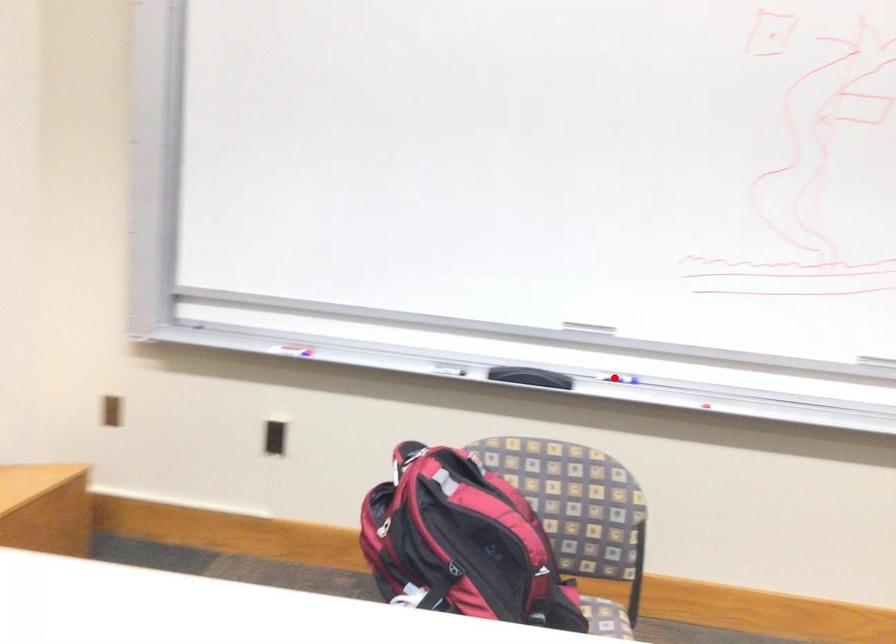
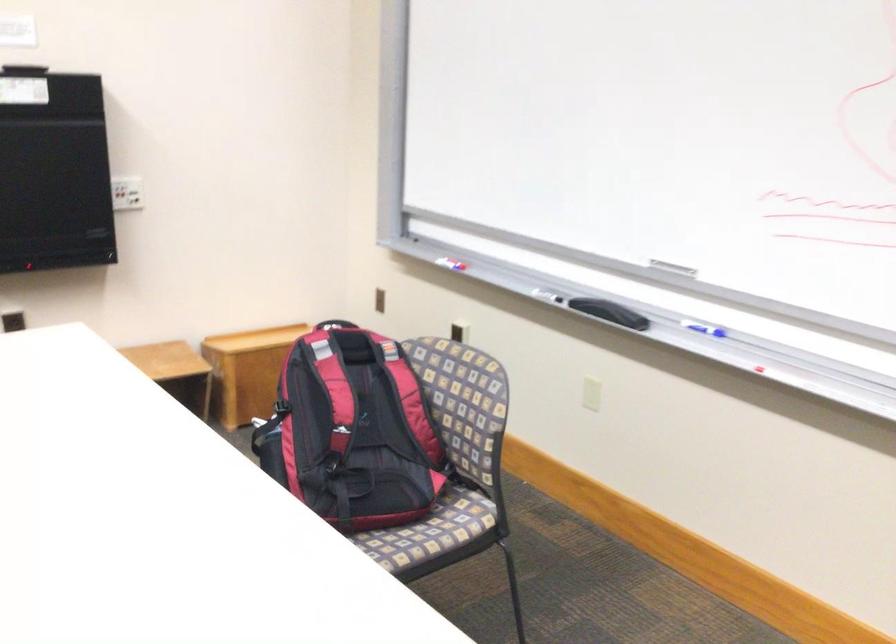
The point at the highlighted location is marked in the first image. Where is the corresponding point in the second image?

(702, 328)